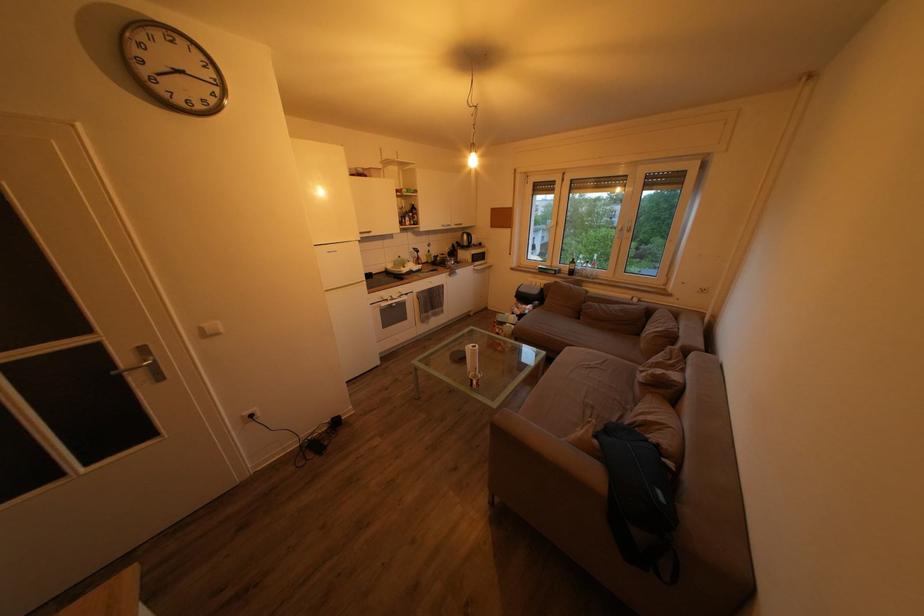
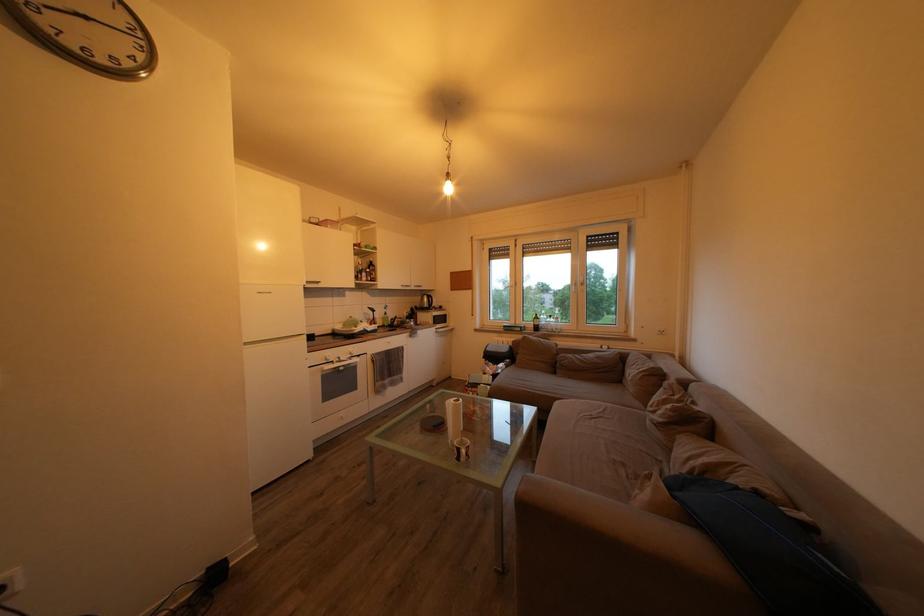
In the second image, find the point that corresponds to the point at 220,107 in the first image.

(134, 69)